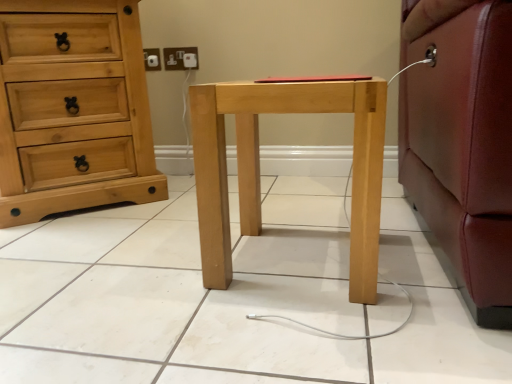
Identify the location of vacant space positioned to the left of natural wood nightstand at center. click(147, 273).